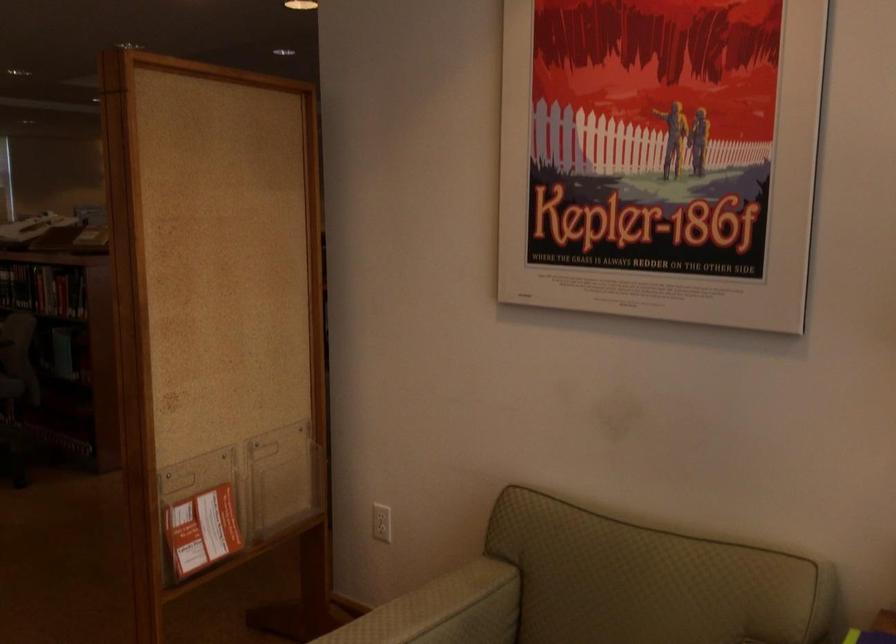
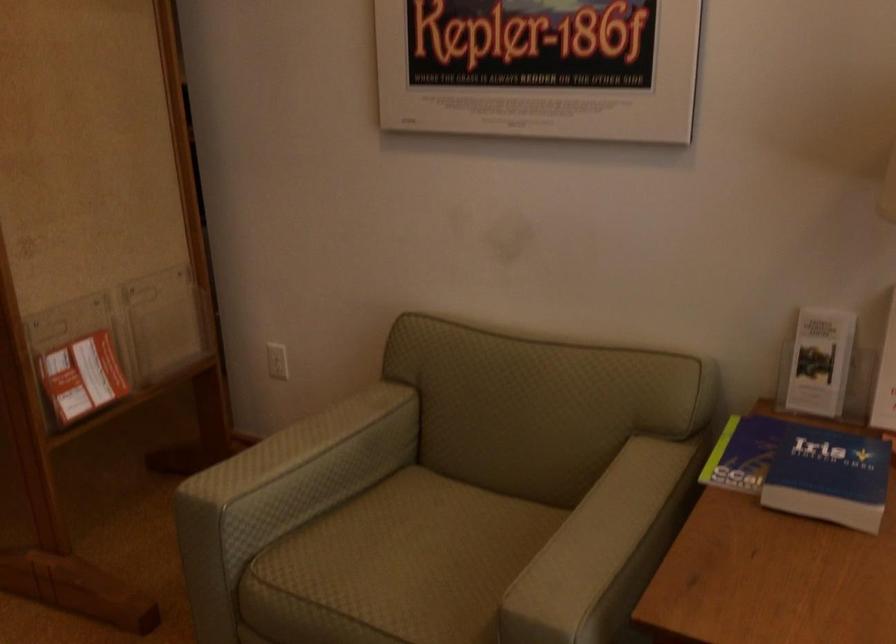
Question: The images are taken continuously from a first-person perspective. In which direction are you moving?

Choices:
 (A) Left
 (B) Right
 (C) Forward
 (D) Backward

Answer: (C)